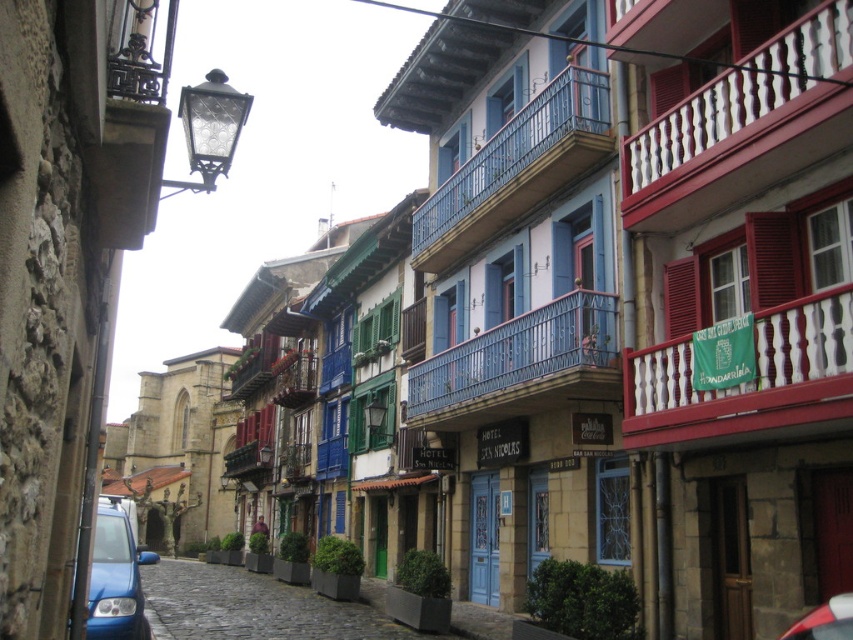
You are an architect designing a new balcony for a building in this European town. You need to decide between the white wooden railing at upper right and the blue painted metal railing at upper center. Based on their spatial requirements, which railing would you choose if you want to minimize the space taken up by the railing?

The white wooden railing at upper right occupies less space than the blue painted metal railing at upper center, so you should choose the white wooden railing at upper right to minimize the space taken up by the railing.

You are standing at the center of the street looking towards the buildings on the right. There is a point marked at coordinates (x=744, y=125). Which object does this point correspond to?

The point at coordinates (x=744, y=125) corresponds to the white wooden railing at upper right.

You are a tourist standing in the middle of the cobblestone street. You notice the blue wrought iron balcony at center and the blue matte car at lower left. Which object is shorter in height?

The blue wrought iron balcony at center is not as tall as the blue matte car at lower left, so the balcony is shorter in height.